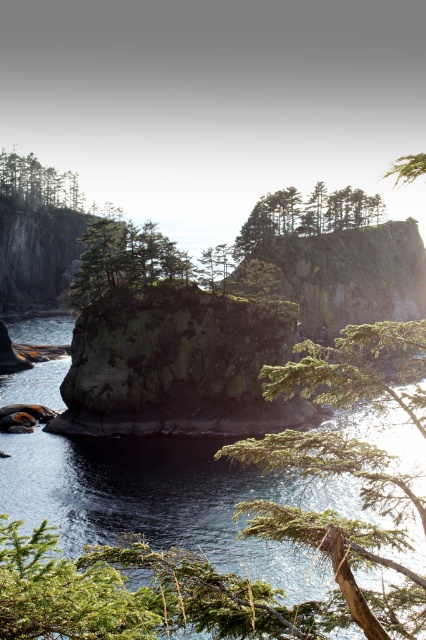
Can you confirm if dark blue water at center is thinner than green matte tree at center?

Yes, dark blue water at center is thinner than green matte tree at center.

What do you see at coordinates (264, 582) in the screenshot? I see `dark blue water at center` at bounding box center [264, 582].

Where is `dark blue water at center`? dark blue water at center is located at coordinates (264, 582).

Does dark blue water at center lie in front of green rough tree at center?

Yes, it is in front of green rough tree at center.

Where is `dark blue water at center`? The image size is (426, 640). dark blue water at center is located at coordinates (264, 582).

Can you confirm if green matte tree at center is positioned above green rough tree at center?

Yes.

Is green matte tree at center bigger than green rough tree at center?

Yes.

Which is behind, point (313, 202) or point (92, 291)?

Point (313, 202)

Image resolution: width=426 pixels, height=640 pixels. I want to click on green matte tree at center, so click(305, 216).